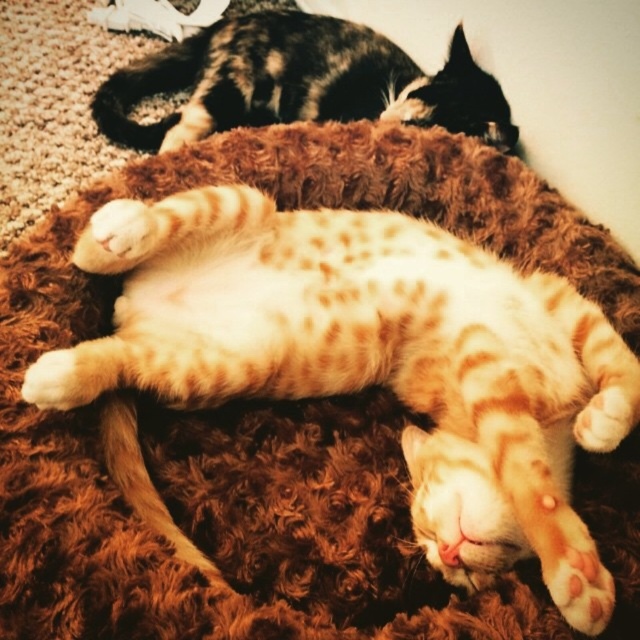
Question: Which point appears farthest from the camera in this image?

Choices:
 (A) (236, 58)
 (B) (532, 548)

Answer: (A)

Question: Which point is closer to the camera taking this photo?

Choices:
 (A) (113, 474)
 (B) (460, 36)

Answer: (A)

Question: Can you confirm if orange spotted fur cat at center is positioned below tabby fur cat at upper center?

Choices:
 (A) no
 (B) yes

Answer: (B)

Question: Does orange spotted fur cat at center have a lesser width compared to tabby fur cat at upper center?

Choices:
 (A) yes
 (B) no

Answer: (A)

Question: Can you confirm if orange spotted fur cat at center is positioned above tabby fur cat at upper center?

Choices:
 (A) no
 (B) yes

Answer: (A)